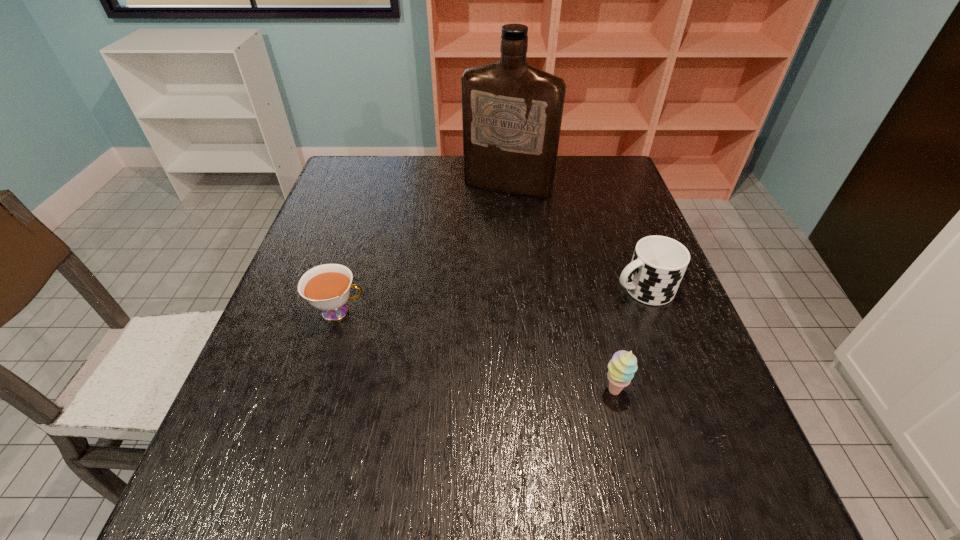
You are a GUI agent. You are given a task and a screenshot of the screen. Output one action in this format:
    pyautogui.click(x=<x>, y=<y>)
    Task: Click on the free spot between the rightmost object and the leftmost object
    
    Given the screenshot: What is the action you would take?
    pyautogui.click(x=491, y=300)

Image resolution: width=960 pixels, height=540 pixels. Identify the location of vacant area that lies between the shortest object and the rightmost object. (491, 300).

The image size is (960, 540). In order to click on vacant region between the farthest object and the rightmost object in this screenshot , I will do `click(575, 238)`.

The width and height of the screenshot is (960, 540). I want to click on free space between the third object from left to right and the liquor, so click(561, 288).

Select which object is the closest to the second object from right to left. Please provide its 2D coordinates. Your answer should be formatted as a tuple, i.e. [(x, y)], where the tuple contains the x and y coordinates of a point satisfying the conditions above.

[(658, 264)]

The image size is (960, 540). In order to click on the third closest object relative to the third object from left to right in this screenshot , I will do `click(512, 112)`.

Find the location of a particular element. free space that satisfies the following two spatial constraints: 1. on the front side of the third object from left to right; 2. on the left side of the second object from left to right is located at coordinates (524, 390).